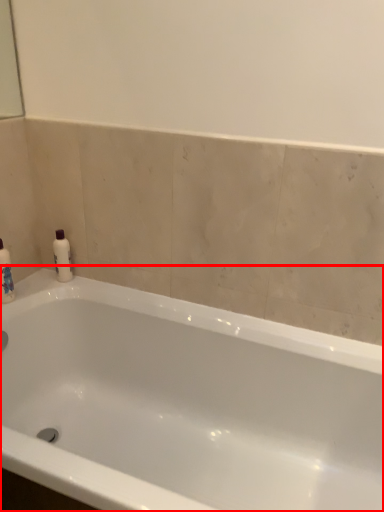
Question: From the image's perspective, what is the correct spatial relationship of bathtub (annotated by the red box) in relation to mouthwash?

Choices:
 (A) above
 (B) below

Answer: (B)